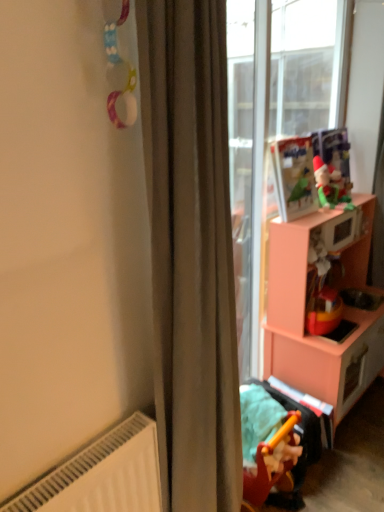
Question: Is matte plastic toy at upper right, acting as the 1th toy starting from the back, touching satin beige curtain at center?

Choices:
 (A) no
 (B) yes

Answer: (A)

Question: Considering the relative positions of matte plastic toy at upper right, acting as the 1th toy starting from the back, and satin beige curtain at center in the image provided, is matte plastic toy at upper right, acting as the 1th toy starting from the back, to the right of satin beige curtain at center from the viewer's perspective?

Choices:
 (A) no
 (B) yes

Answer: (B)

Question: Can you confirm if matte plastic toy at upper right, acting as the 1th toy starting from the back, is thinner than satin beige curtain at center?

Choices:
 (A) no
 (B) yes

Answer: (B)

Question: Is matte plastic toy at upper right, which is counted as the 2th toy, starting from the front, shorter than satin beige curtain at center?

Choices:
 (A) no
 (B) yes

Answer: (B)

Question: Does matte plastic toy at upper right, which is the 2th toy in bottom-to-top order, have a greater width compared to satin beige curtain at center?

Choices:
 (A) no
 (B) yes

Answer: (A)

Question: Is matte plastic toy at upper right, acting as the 1th toy starting from the back, positioned beyond the bounds of satin beige curtain at center?

Choices:
 (A) yes
 (B) no

Answer: (A)

Question: Is satin beige curtain at center smaller than matte plastic toy at upper right, which is counted as the 2th toy, starting from the front?

Choices:
 (A) yes
 (B) no

Answer: (B)

Question: Is satin beige curtain at center oriented towards matte plastic toy at upper right, the 2th toy viewed from the left?

Choices:
 (A) no
 (B) yes

Answer: (A)

Question: Is satin beige curtain at center positioned in front of matte plastic toy at upper right, acting as the 1th toy starting from the back?

Choices:
 (A) yes
 (B) no

Answer: (A)

Question: Is satin beige curtain at center not within matte plastic toy at upper right, which ranks as the first toy in top-to-bottom order?

Choices:
 (A) yes
 (B) no

Answer: (A)

Question: Is satin beige curtain at center wider than matte plastic toy at upper right, which is counted as the 2th toy, starting from the front?

Choices:
 (A) no
 (B) yes

Answer: (B)

Question: Is satin beige curtain at center at the left side of matte plastic toy at upper right, arranged as the first toy when viewed from the right?

Choices:
 (A) yes
 (B) no

Answer: (A)

Question: Is yellow plastic toy at lower right, which is the second toy in right-to-left order, positioned beyond the bounds of pink matte cabinet at right?

Choices:
 (A) yes
 (B) no

Answer: (A)